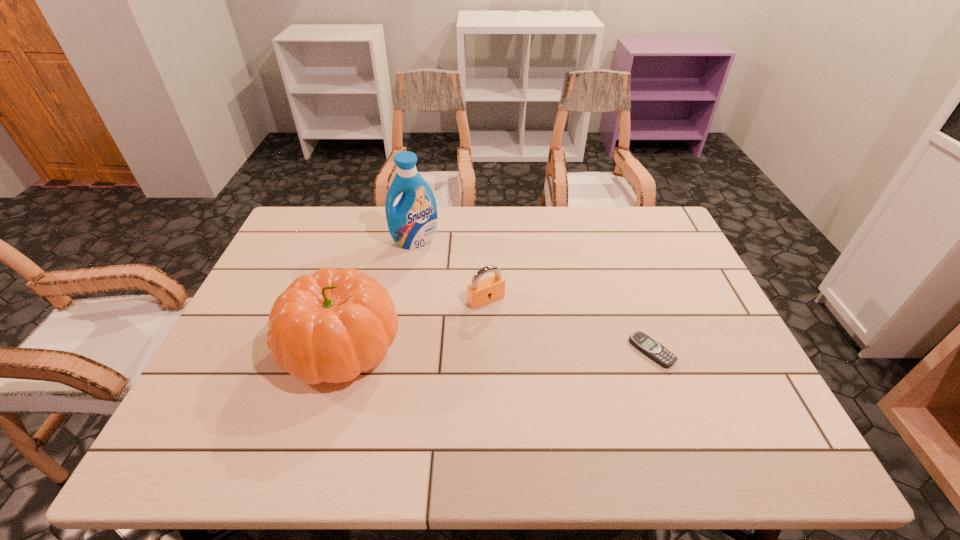
Locate an element on the screen. Image resolution: width=960 pixels, height=540 pixels. free space on the desktop that is between the third shortest object and the beeper and is positioned on the front-facing side of the detergent is located at coordinates (450, 348).

The height and width of the screenshot is (540, 960). Find the location of `free spot on the desktop that is between the second tallest object and the shortest object and is positioned to unlock the second shortest object from the front`. free spot on the desktop that is between the second tallest object and the shortest object and is positioned to unlock the second shortest object from the front is located at coordinates (x=526, y=349).